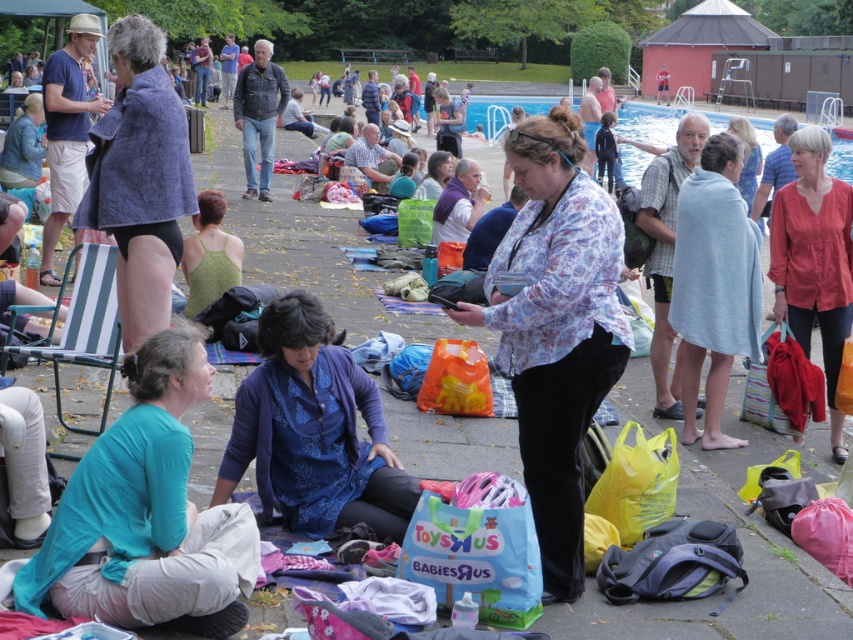
You are trying to decide which top to wear for a casual day out. The floral print blouse at center and the green knitted tank top at center are both options. Based on their sizes in the image, which one would you choose if you prefer a more oversized look?

The floral print blouse at center is larger than the green knitted tank top at center, so you should choose the floral print blouse at center for a more oversized look.

You are standing in the pool area and want to locate two specific points marked in the image. The first point is at coordinates point (408, 540) and the second is at point (451, 221). Which of these two points is nearer to your current position?

Point (408, 540) is closer to the viewer than point (451, 221), so the first point is nearer to your current position.

You are trying to decide which clothing item to choose for a casual day out. Both the matte blue dress at center and the blue fabric shirt at center are options. Based on the image, which one has a wider silhouette?

The matte blue dress at center is wider than the blue fabric shirt at center, so the matte blue dress at center has a wider silhouette.